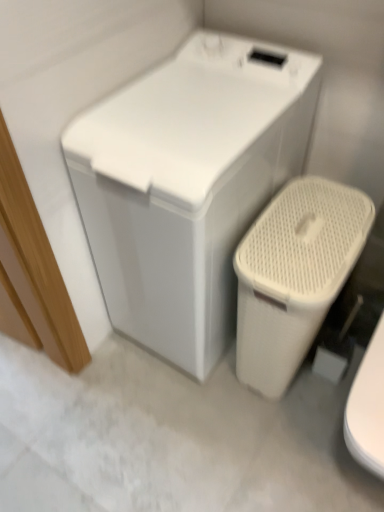
Where is `free location in front of white matte washing machine at upper center`? This screenshot has width=384, height=512. free location in front of white matte washing machine at upper center is located at coordinates (187, 434).